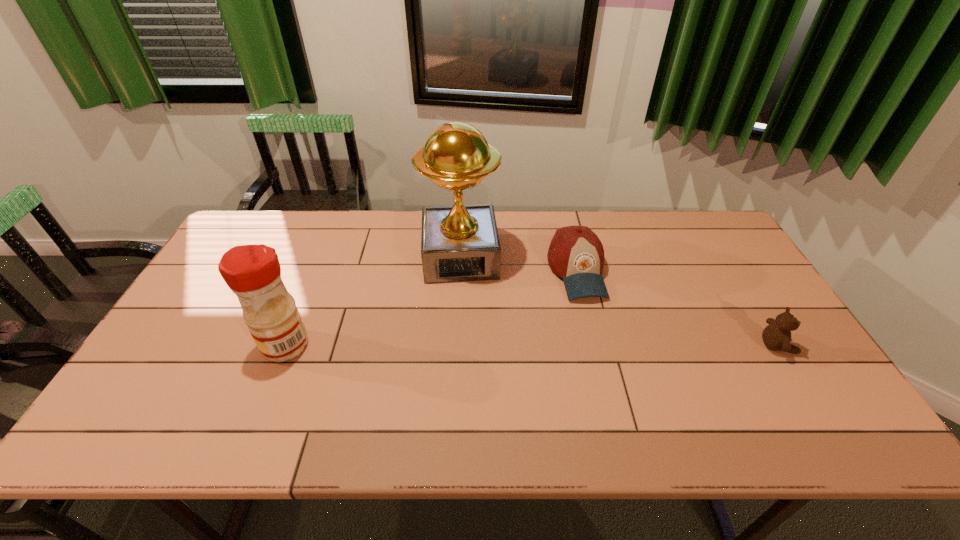
Locate an element on the screen. The width and height of the screenshot is (960, 540). vacant space on the desktop that is between the condiment and the rightmost object and is positioned on the front-facing side of the award is located at coordinates (467, 345).

This screenshot has width=960, height=540. What are the coordinates of `free space on the desktop that is between the leftmost object and the teddy bear and is positioned on the front-facing side of the third object from left to right` in the screenshot? It's located at (604, 346).